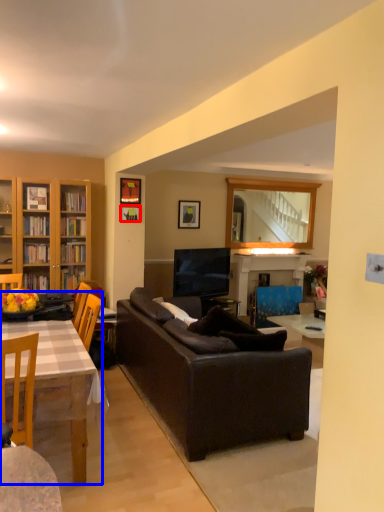
Question: Which object appears farthest to the camera in this image, picture frame (highlighted by a red box) or table (highlighted by a blue box)?

Choices:
 (A) picture frame
 (B) table

Answer: (A)